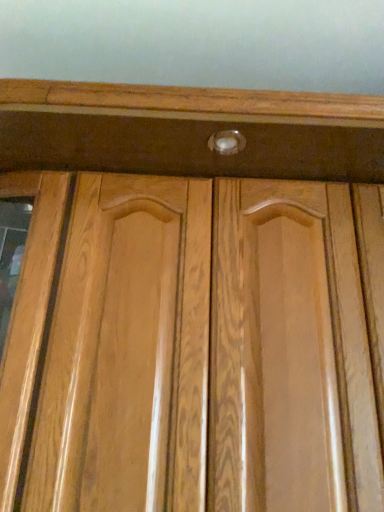
This screenshot has height=512, width=384. What do you see at coordinates (227, 142) in the screenshot?
I see `satin nickel knob at center` at bounding box center [227, 142].

I want to click on satin nickel knob at center, so click(x=227, y=142).

Measure the distance between satin nickel knob at center and camera.

The depth of satin nickel knob at center is 31.44 inches.

Measure the distance between point (230, 155) and camera.

A distance of 34.09 inches exists between point (230, 155) and camera.

Locate an element on the screen. The width and height of the screenshot is (384, 512). satin nickel knob at center is located at coordinates (227, 142).